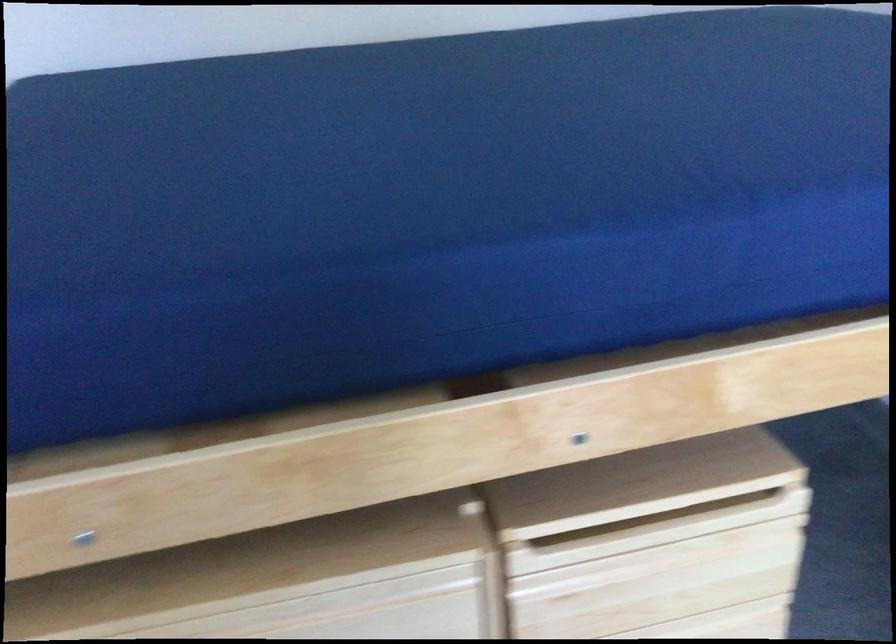
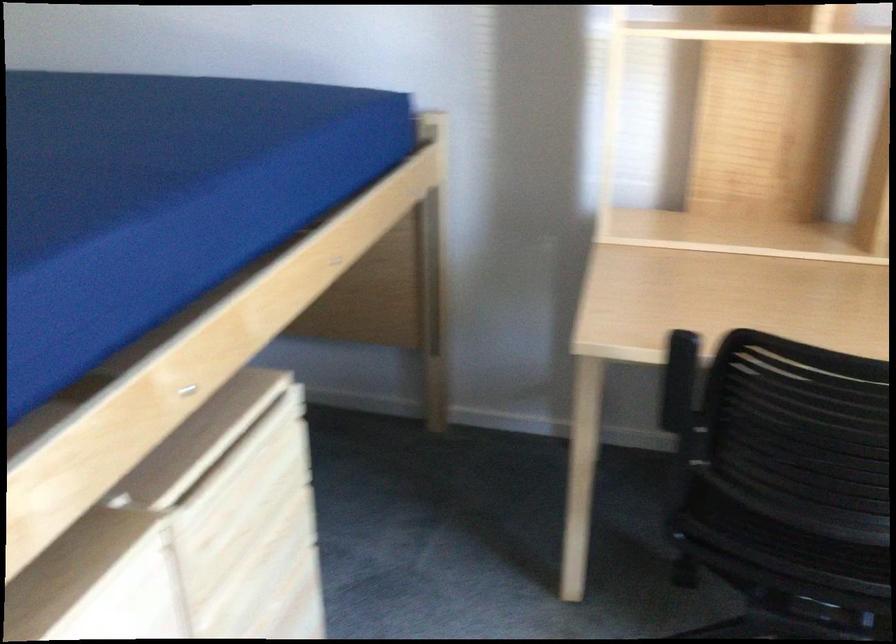
Question: How did the camera likely rotate?

Choices:
 (A) Left
 (B) Right
 (C) Up
 (D) Down

Answer: (B)